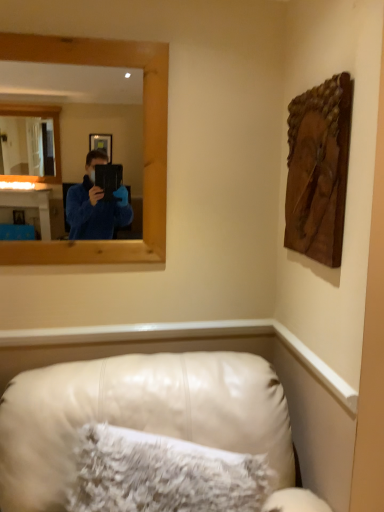
Question: Is leather couch at lower center in front of or behind wooden carving at upper right in the image?

Choices:
 (A) behind
 (B) front

Answer: (B)

Question: From the image's perspective, is leather couch at lower center located above or below wooden carving at upper right?

Choices:
 (A) below
 (B) above

Answer: (A)

Question: Based on their relative distances, which object is farther from the wooden frame at upper left?

Choices:
 (A) wooden carving at upper right
 (B) leather couch at lower center
 (C) white fluffy pillow at lower center

Answer: (C)

Question: Considering the real-world distances, which object is closest to the wooden frame at upper left?

Choices:
 (A) leather couch at lower center
 (B) white fluffy pillow at lower center
 (C) wooden carving at upper right

Answer: (C)